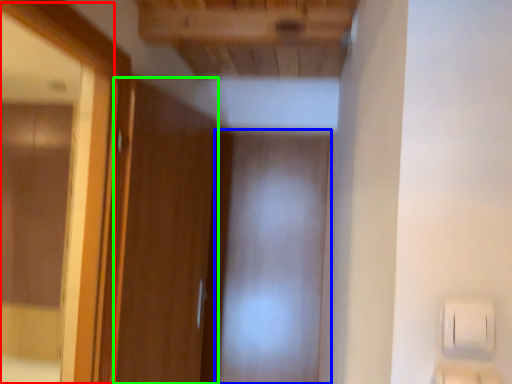
Question: Which is nearer to the mirror (highlighted by a red box)? screen door (highlighted by a blue box) or door (highlighted by a green box).

Choices:
 (A) screen door
 (B) door

Answer: (B)